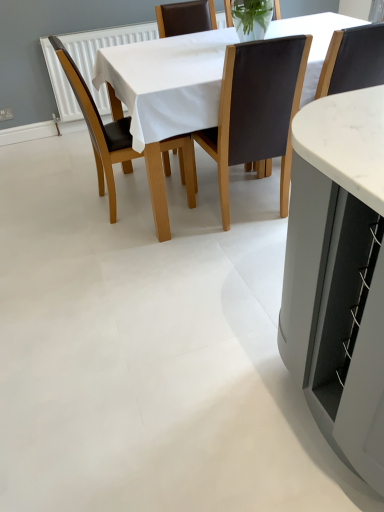
Question: Does brown leather chair at center, arranged as the 1th chair when viewed from the left, have a lesser width compared to white fabric table at center?

Choices:
 (A) no
 (B) yes

Answer: (B)

Question: Is white fabric table at center surrounded by brown leather chair at center, arranged as the 1th chair when viewed from the left?

Choices:
 (A) no
 (B) yes

Answer: (A)

Question: Can you confirm if brown leather chair at center, arranged as the 1th chair when viewed from the left, is bigger than white fabric table at center?

Choices:
 (A) no
 (B) yes

Answer: (A)

Question: Is brown leather chair at center, arranged as the 3th chair when viewed from the right, smaller than white fabric table at center?

Choices:
 (A) no
 (B) yes

Answer: (B)

Question: From a real-world perspective, is brown leather chair at center, arranged as the 3th chair when viewed from the right, over white fabric table at center?

Choices:
 (A) yes
 (B) no

Answer: (A)

Question: Does point (228, 62) appear closer or farther from the camera than point (59, 46)?

Choices:
 (A) closer
 (B) farther

Answer: (A)

Question: Is brown leather chair at center, acting as the second chair starting from the right, wider or thinner than brown leather chair at center, arranged as the 1th chair when viewed from the left?

Choices:
 (A) thin
 (B) wide

Answer: (A)

Question: Choose the correct answer: Is brown leather chair at center, acting as the second chair starting from the right, inside brown leather chair at center, arranged as the 1th chair when viewed from the left, or outside it?

Choices:
 (A) inside
 (B) outside

Answer: (B)

Question: In terms of height, does brown leather chair at center, positioned as the second chair in left-to-right order, look taller or shorter compared to brown leather chair at center, arranged as the 1th chair when viewed from the left?

Choices:
 (A) tall
 (B) short

Answer: (A)

Question: From a real-world perspective, is brown leather chair at center, arranged as the 1th chair when viewed from the left, positioned above or below white fabric table at center?

Choices:
 (A) above
 (B) below

Answer: (A)

Question: Considering the relative positions of brown leather chair at center, arranged as the 1th chair when viewed from the left, and white fabric table at center in the image provided, is brown leather chair at center, arranged as the 1th chair when viewed from the left, to the left or to the right of white fabric table at center?

Choices:
 (A) left
 (B) right

Answer: (A)

Question: From the image's perspective, relative to white fabric table at center, is brown leather chair at center, arranged as the 3th chair when viewed from the right, above or below?

Choices:
 (A) above
 (B) below

Answer: (B)

Question: Is point (64, 56) closer or farther from the camera than point (142, 44)?

Choices:
 (A) farther
 (B) closer

Answer: (B)

Question: From the image's perspective, is brown leather chair at center, arranged as the 3th chair when viewed from the right, located above or below brown leather chair at center, positioned as the second chair in left-to-right order?

Choices:
 (A) below
 (B) above

Answer: (B)

Question: From a real-world perspective, is brown leather chair at center, arranged as the 3th chair when viewed from the right, above or below brown leather chair at center, positioned as the second chair in left-to-right order?

Choices:
 (A) above
 (B) below

Answer: (B)